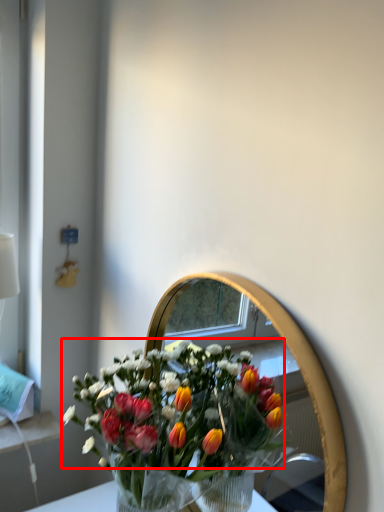
Question: From the image's perspective, considering the relative positions of flower (annotated by the red box) and mirror in the image provided, where is flower (annotated by the red box) located with respect to the staircase?

Choices:
 (A) above
 (B) below

Answer: (B)